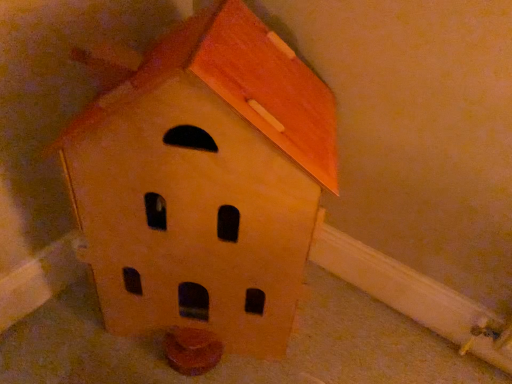
At what (x,y) coordinates should I click in order to perform the action: click on vacant area that lies to the right of matte wood house at center. Please return your answer as a coordinate pair (x, y). Looking at the image, I should click on (359, 329).